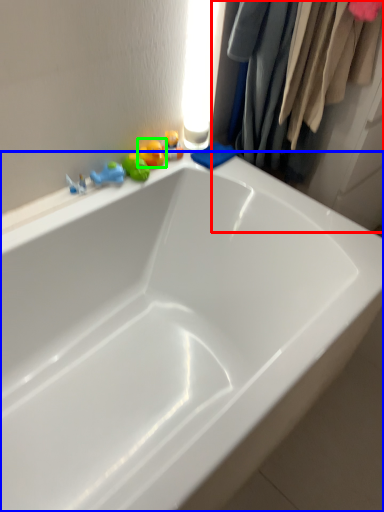
Question: Which object is the closest to the closet (highlighted by a red box)? Choose among these: bathtub (highlighted by a blue box) or toy (highlighted by a green box).

Choices:
 (A) bathtub
 (B) toy

Answer: (B)